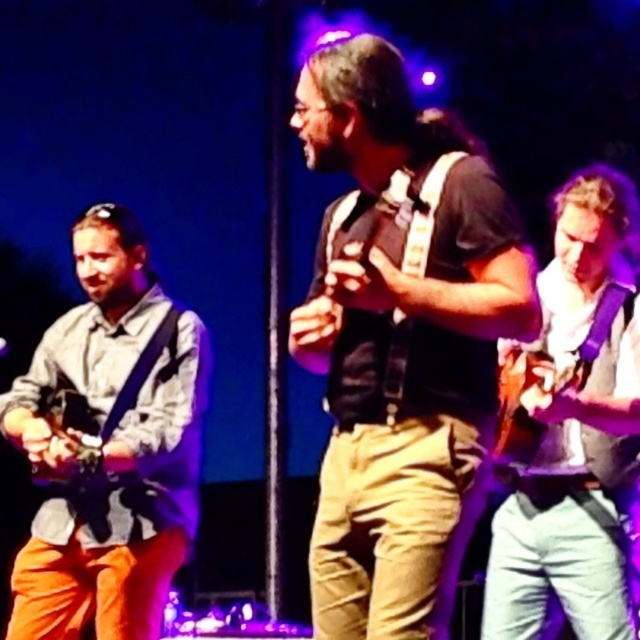
Can you confirm if light gray fabric shirt at left is thinner than white matte guitar at right?

No.

Is point (166, 506) positioned before point (625, 262)?

Yes, point (166, 506) is in front of point (625, 262).

Is point (125, 486) behind point (618, 291)?

No, (125, 486) is in front of (618, 291).

You are a GUI agent. You are given a task and a screenshot of the screen. Output one action in this format:
    pyautogui.click(x=<x>, y=<y>)
    Task: Click on the light gray fabric shirt at left
    Image resolution: width=640 pixels, height=640 pixels.
    Given the screenshot: What is the action you would take?
    pyautogui.click(x=109, y=444)

Is matte black vest at center below white matte guitar at right?

No, matte black vest at center is not below white matte guitar at right.

From the picture: Which is more to the right, matte black vest at center or white matte guitar at right?

white matte guitar at right

Locate an element on the screen. Image resolution: width=640 pixels, height=640 pixels. matte black vest at center is located at coordinates (401, 340).

The width and height of the screenshot is (640, 640). What are the coordinates of `matte black vest at center` in the screenshot? It's located at click(x=401, y=340).

Is matte black vest at center thinner than light gray fabric shirt at left?

Indeed, matte black vest at center has a lesser width compared to light gray fabric shirt at left.

Which is below, matte black vest at center or light gray fabric shirt at left?

Positioned lower is light gray fabric shirt at left.

Is point (333, 429) positioned after point (124, 252)?

That is False.

You are a GUI agent. You are given a task and a screenshot of the screen. Output one action in this format:
    pyautogui.click(x=<x>, y=<y>)
    Task: Click on the matte black vest at center
    
    Given the screenshot: What is the action you would take?
    pyautogui.click(x=401, y=340)